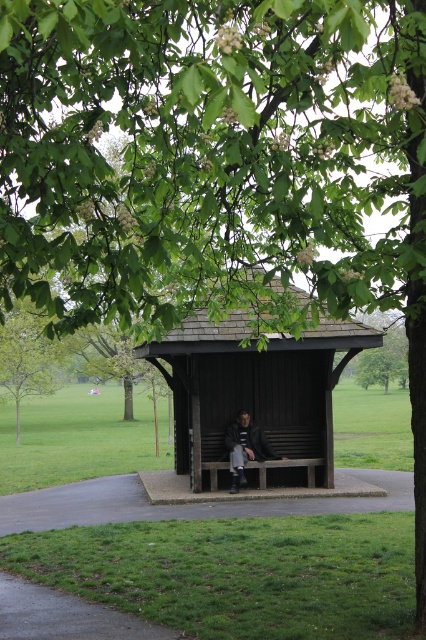
Which is behind, point (259, 376) or point (17, 365)?

Point (17, 365)

Who is higher up, brown wooden bench at center or green leafy tree at lower left?

brown wooden bench at center

Who is more distant from viewer, (207, 464) or (63, 380)?

Positioned behind is point (63, 380).

Find the location of `brown wooden bench at center`. brown wooden bench at center is located at coordinates (255, 392).

Can you confirm if brown wooden bench at center is positioned above wooden bench at center?

Yes, brown wooden bench at center is above wooden bench at center.

Is brown wooden bench at center to the left of wooden bench at center from the viewer's perspective?

Correct, you'll find brown wooden bench at center to the left of wooden bench at center.

Where is `brown wooden bench at center`? This screenshot has width=426, height=640. brown wooden bench at center is located at coordinates (255, 392).

At what (x,y) coordinates should I click in order to perform the action: click on brown wooden bench at center. Please return your answer as a coordinate pair (x, y). This screenshot has width=426, height=640. Looking at the image, I should click on (255, 392).

Looking at this image, which is above, wooden bench at center or dark gray leather jacket at center?

dark gray leather jacket at center

Which is below, wooden bench at center or dark gray leather jacket at center?

wooden bench at center is below.

Which is in front, point (310, 433) or point (224, 440)?

Point (224, 440) is more forward.

Find the location of `wooden bench at center`. wooden bench at center is located at coordinates (291, 451).